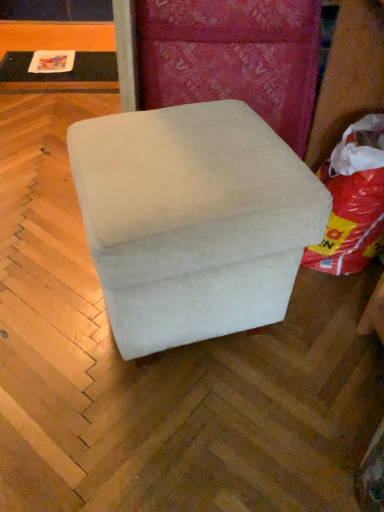
Where is `free space in front of white fabric bean bag at right`? The width and height of the screenshot is (384, 512). free space in front of white fabric bean bag at right is located at coordinates (332, 315).